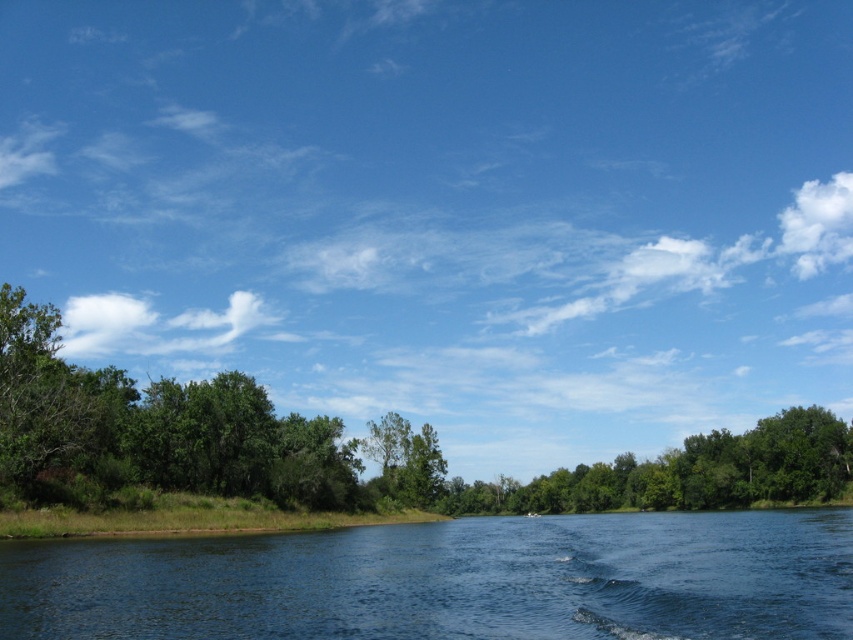
Question: Is blue smooth water at center thinner than green leafy tree at lower center?

Choices:
 (A) no
 (B) yes

Answer: (B)

Question: Which point is farther to the camera?

Choices:
 (A) green leafy tree at lower center
 (B) blue smooth water at center

Answer: (A)

Question: Can you confirm if blue smooth water at center is positioned to the left of green leafy tree at lower center?

Choices:
 (A) yes
 (B) no

Answer: (A)

Question: Is blue smooth water at center above green leafy tree at lower center?

Choices:
 (A) no
 (B) yes

Answer: (B)

Question: Which point is farther to the camera?

Choices:
 (A) (602, 472)
 (B) (712, 520)

Answer: (A)

Question: Which point is farther to the camera?

Choices:
 (A) green leafy tree at lower center
 (B) blue smooth water at center

Answer: (A)